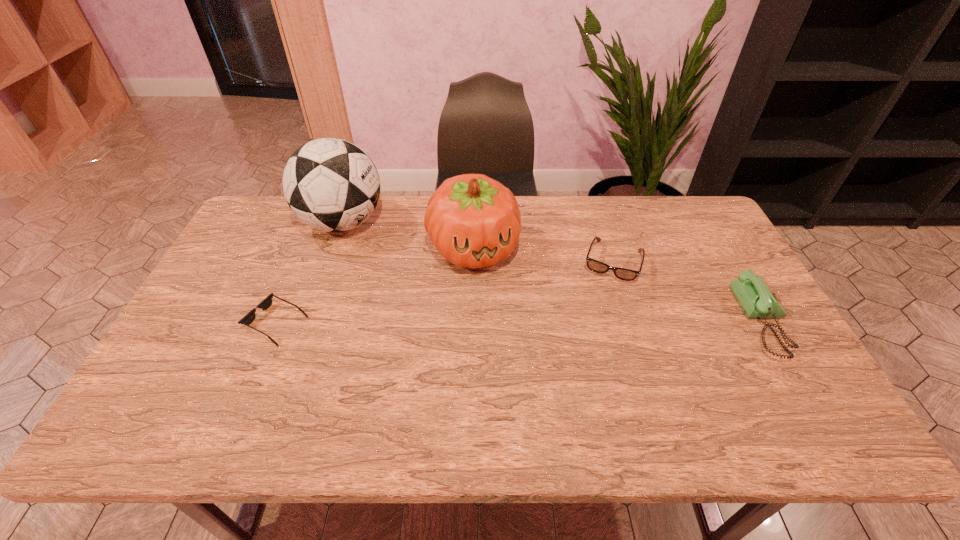
The width and height of the screenshot is (960, 540). In order to click on soccer ball situated at the far edge in this screenshot , I will do `click(330, 184)`.

Where is `object positioned at the left edge`? object positioned at the left edge is located at coordinates (248, 319).

The height and width of the screenshot is (540, 960). I want to click on object located at the right edge, so click(x=757, y=300).

In the image, there is a desktop. Where is `free region at the far edge`? free region at the far edge is located at coordinates (614, 206).

Where is `free location at the near edge of the desktop`? free location at the near edge of the desktop is located at coordinates (552, 390).

Image resolution: width=960 pixels, height=540 pixels. In the image, there is a desktop. In order to click on vacant space at the right edge in this screenshot , I will do `click(708, 305)`.

The height and width of the screenshot is (540, 960). In the image, there is a desktop. In order to click on vacant area at the far left corner in this screenshot , I will do `click(267, 197)`.

Locate an element on the screen. free location at the far right corner of the desktop is located at coordinates (662, 215).

Locate an element on the screen. vacant area that lies between the rightmost object and the soccer ball is located at coordinates (553, 272).

Find the location of `empty location between the sunglasses and the pumpkin`. empty location between the sunglasses and the pumpkin is located at coordinates (374, 285).